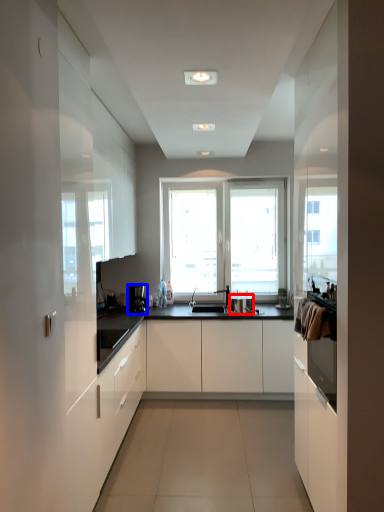
Question: Which point is further to the camera, appliance (highlighted by a red box) or coffee machine (highlighted by a blue box)?

Choices:
 (A) appliance
 (B) coffee machine

Answer: (B)